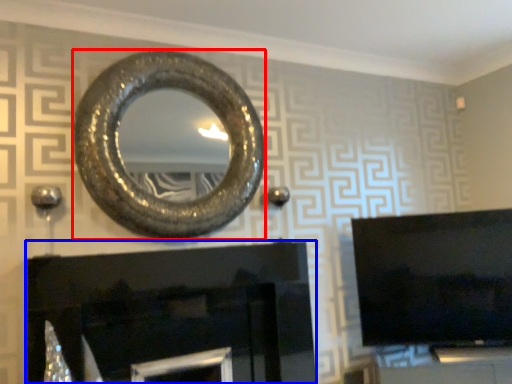
Question: Among these objects, which one is nearest to the camera, oval (highlighted by a red box) or fireplace (highlighted by a blue box)?

Choices:
 (A) oval
 (B) fireplace

Answer: (B)